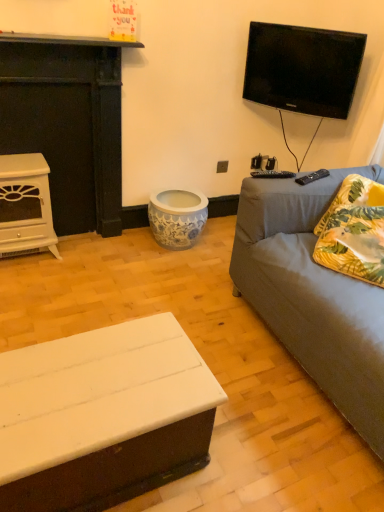
Question: Could you tell me if gray fabric couch at right is turned towards white glossy fireplace at left, which is counted as the 2th fireplace, starting from the top?

Choices:
 (A) no
 (B) yes

Answer: (A)

Question: Does gray fabric couch at right have a lesser width compared to white glossy fireplace at left, which is counted as the 2th fireplace, starting from the top?

Choices:
 (A) no
 (B) yes

Answer: (A)

Question: Is gray fabric couch at right smaller than white glossy fireplace at left, which is counted as the first fireplace, starting from the bottom?

Choices:
 (A) no
 (B) yes

Answer: (A)

Question: From the image's perspective, is gray fabric couch at right under white glossy fireplace at left, which is counted as the first fireplace, starting from the bottom?

Choices:
 (A) no
 (B) yes

Answer: (B)

Question: Can you confirm if gray fabric couch at right is positioned to the right of white glossy fireplace at left, which is counted as the 2th fireplace, starting from the top?

Choices:
 (A) yes
 (B) no

Answer: (A)

Question: From a real-world perspective, is gray fabric couch at right under white glossy fireplace at left, which is counted as the first fireplace, starting from the bottom?

Choices:
 (A) no
 (B) yes

Answer: (A)

Question: Can yellow floral fabric pillow at right be found inside white glossy fireplace at left, which is counted as the first fireplace, starting from the bottom?

Choices:
 (A) yes
 (B) no

Answer: (B)

Question: Is white glossy fireplace at left, which is counted as the 2th fireplace, starting from the top, far from yellow floral fabric pillow at right?

Choices:
 (A) no
 (B) yes

Answer: (B)

Question: Is white glossy fireplace at left, which is counted as the 2th fireplace, starting from the top, outside yellow floral fabric pillow at right?

Choices:
 (A) yes
 (B) no

Answer: (A)

Question: Is white glossy fireplace at left, which is counted as the 2th fireplace, starting from the top, turned away from yellow floral fabric pillow at right?

Choices:
 (A) no
 (B) yes

Answer: (A)

Question: From a real-world perspective, is white glossy fireplace at left, which is counted as the 2th fireplace, starting from the top, on top of yellow floral fabric pillow at right?

Choices:
 (A) yes
 (B) no

Answer: (B)

Question: Could you tell me if white glossy fireplace at left, which is counted as the 2th fireplace, starting from the top, is facing yellow floral fabric pillow at right?

Choices:
 (A) no
 (B) yes

Answer: (A)

Question: Is white matte coffee table at lower left not inside black glossy tv at upper right?

Choices:
 (A) yes
 (B) no

Answer: (A)